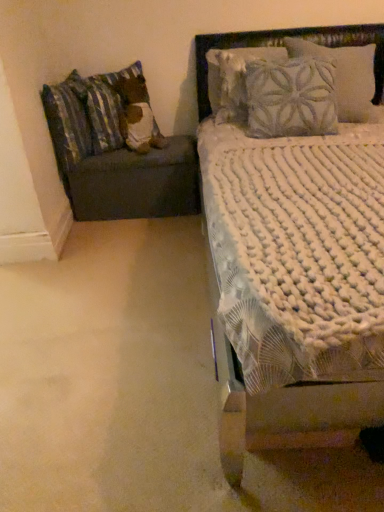
In order to click on free space in front of dark gray fabric ottoman at left in this screenshot , I will do `click(139, 248)`.